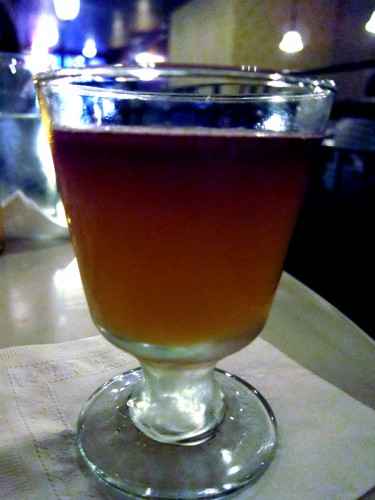
Locate an element on the screen. napkin is located at coordinates 51,442.